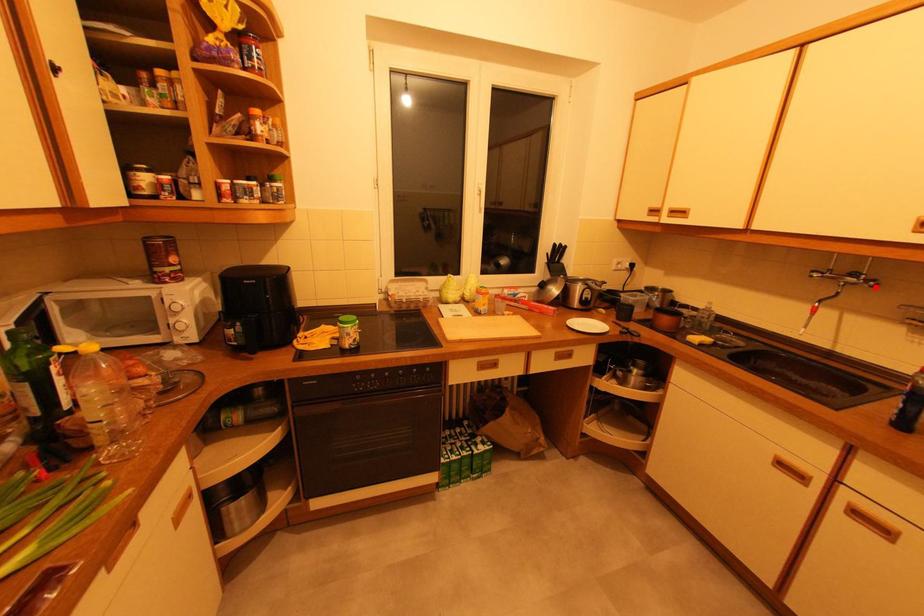
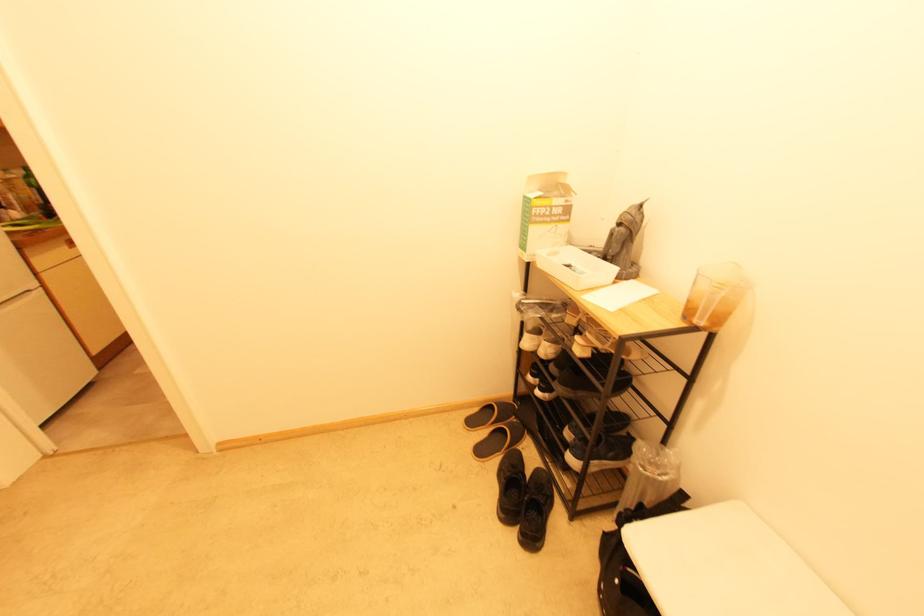
Question: I am providing you with two images of the same scene from different viewpoints. A red point is marked on the first image. Can you still see the location of the red point in image 2?

Choices:
 (A) Yes
 (B) No

Answer: (B)